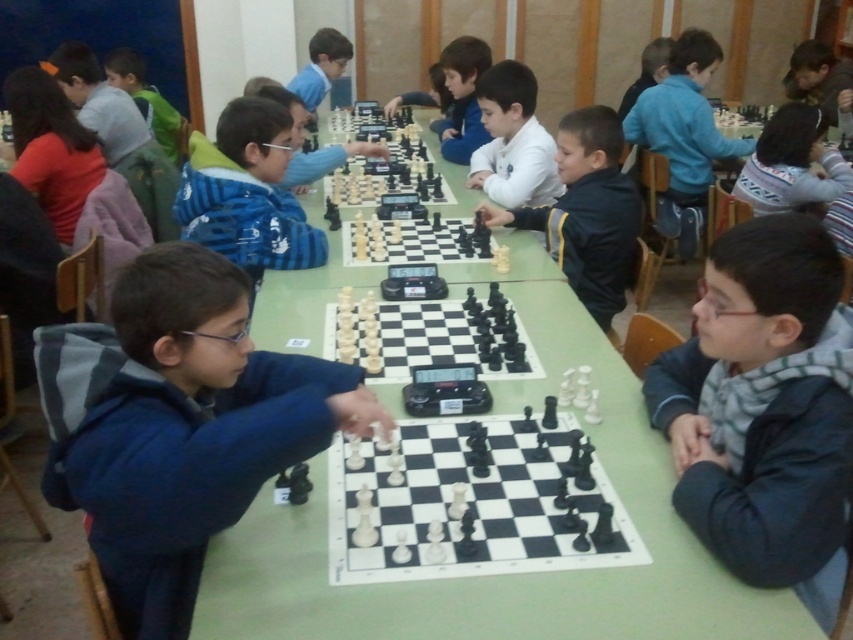
Can you confirm if white matte chess piece at center is smaller than white shirt at center?

No.

Does point (567, 164) come closer to viewer compared to point (524, 148)?

Yes, point (567, 164) is in front of point (524, 148).

Who is more forward, (618, 176) or (509, 77)?

Positioned in front is point (618, 176).

The image size is (853, 640). Find the location of `white matte chess piece at center`. white matte chess piece at center is located at coordinates (587, 212).

Based on the photo, does polished plastic chessboard at center have a lesser height compared to blue fleece jacket at upper right?

Yes.

Can you confirm if polished plastic chessboard at center is wider than blue fleece jacket at upper right?

No, polished plastic chessboard at center is not wider than blue fleece jacket at upper right.

Is point (354, 536) farther from camera compared to point (711, 118)?

No.

The image size is (853, 640). I want to click on polished plastic chessboard at center, so click(469, 504).

Between point (624, 273) and point (447, 88), which one is positioned behind?

Point (447, 88)

Which of these two, white matte chess piece at center or matte blue sweater at center, stands taller?

white matte chess piece at center is taller.

Where is `white matte chess piece at center`? This screenshot has width=853, height=640. white matte chess piece at center is located at coordinates (587, 212).